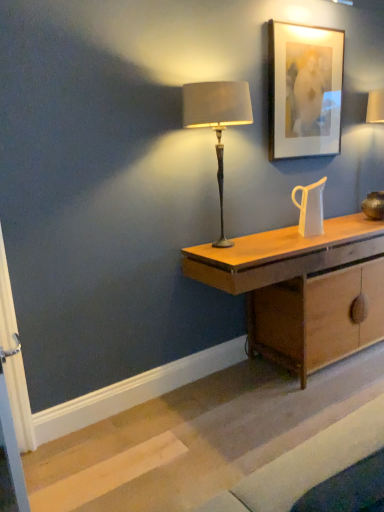
Locate an element on the screen. This screenshot has width=384, height=512. vacant space situated on the left part of transparent glass jug at center is located at coordinates (282, 238).